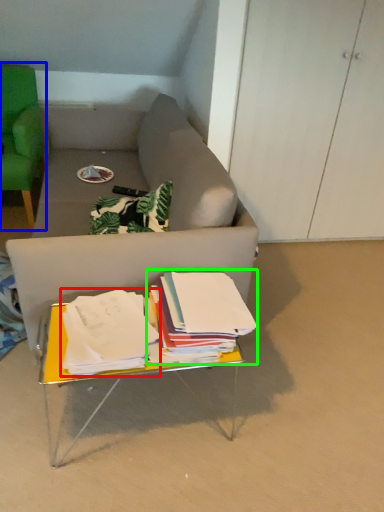
Question: Which is farther away from paperback book (highlighted by a red box)? chair (highlighted by a blue box) or paperback book (highlighted by a green box)?

Choices:
 (A) chair
 (B) paperback book

Answer: (A)